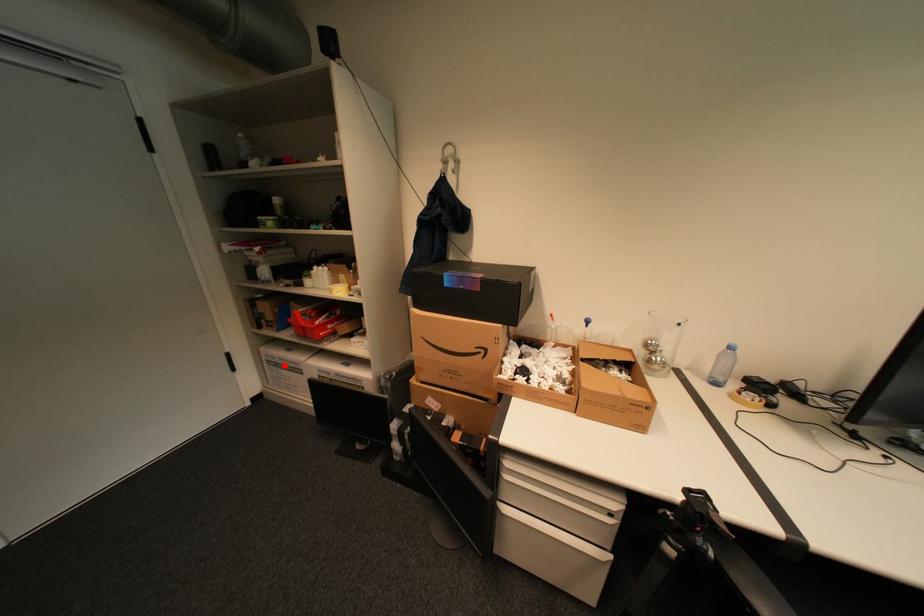
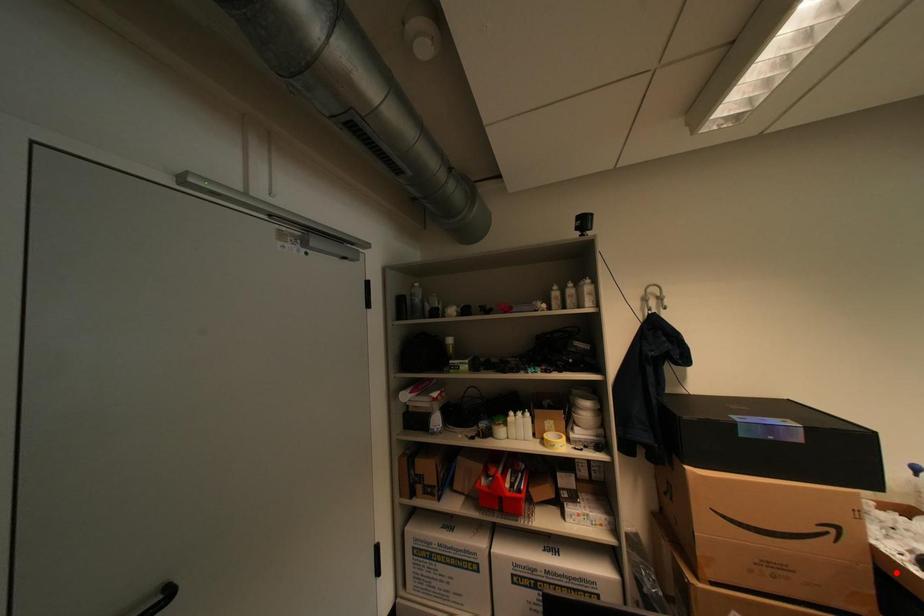
I am providing you with two images of the same scene from different viewpoints. A red point is marked on the first image and another point is marked on the second image. Is the marked point in image1 the same physical position as the marked point in image2?

No